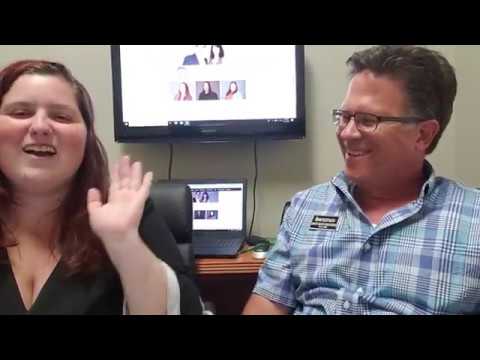
You are a GUI agent. You are given a task and a screenshot of the screen. Output one action in this format:
    pyautogui.click(x=<x>, y=<y>)
    Task: Click on the black monitor
    This screenshot has width=480, height=360.
    Given the screenshot: What is the action you would take?
    pyautogui.click(x=216, y=132)